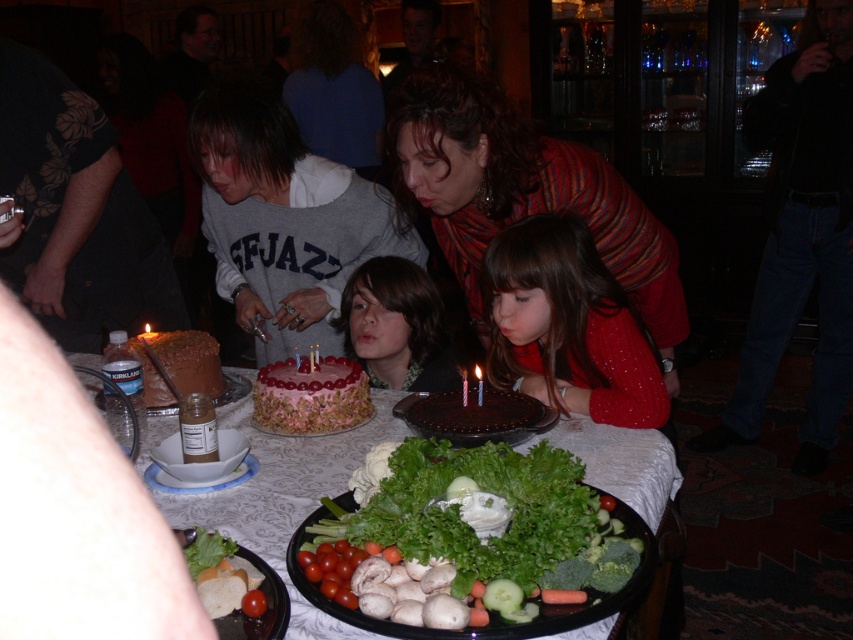
You are a guest at the birthday party and want to place a decorative item exactly at the center of the table. The table has coordinates ranging from 0 to 1 on both axes. Given the smooth pink cake at center is at position 0.511, 0.467, can you determine if the cake is positioned at the true center of the table?

The smooth pink cake at center is located at point (397, 326), which is very close to the true center coordinates of (426, 320). Since the coordinates are nearly identical, the cake is effectively positioned at the center of the table.

Consider the image. You are a guest at the birthday party and want to place the translucent plastic candle at center on the green leafy lettuce at center. Will the candle fit on the lettuce without hanging over the edges?

The green leafy lettuce at center has a larger width than the translucent plastic candle at center, so the candle will fit on the lettuce without hanging over the edges.